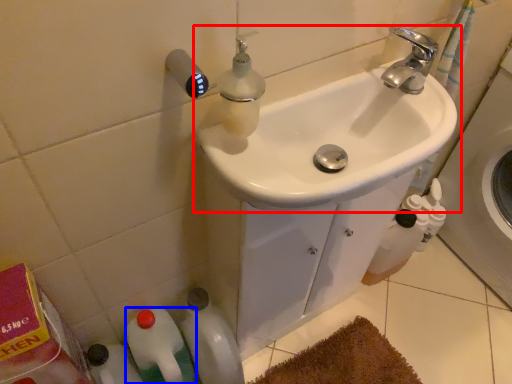
Question: Which of the following is the closest to the observer, sink (highlighted by a red box) or bottle (highlighted by a blue box)?

Choices:
 (A) sink
 (B) bottle

Answer: (A)